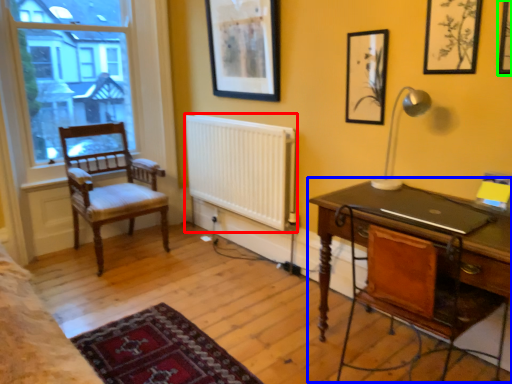
Question: Which is farther away from radiator (highlighted by a red box)? desk (highlighted by a blue box) or picture frame (highlighted by a green box)?

Choices:
 (A) desk
 (B) picture frame

Answer: (B)